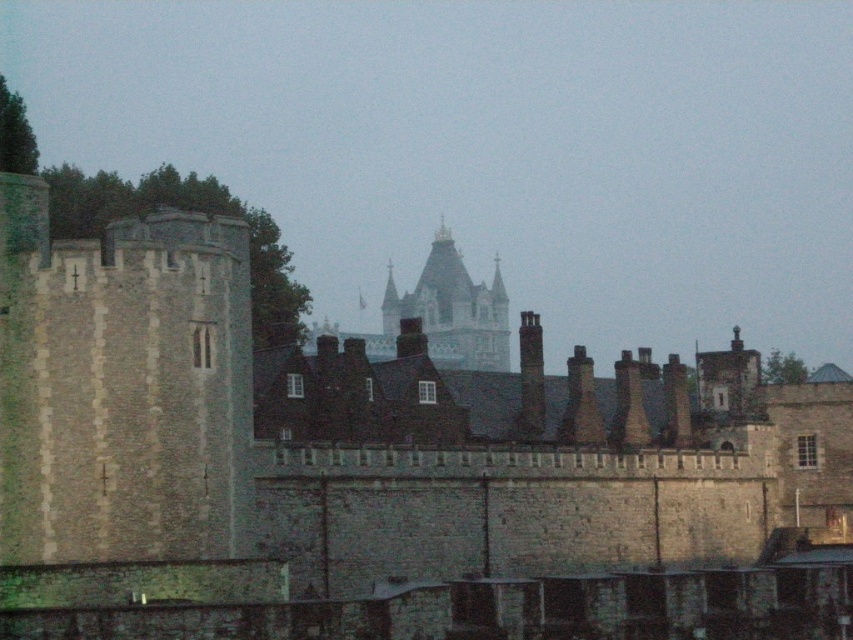
Based on the coordinates provided, where is the stone tower at left located in the image?

The stone tower at left is located at point (380,468) in the image.

You are standing in front of the historic castle wall and notice two points marked on the structure. The first point is at coordinates point (91, 586) and the second is at point (479, 305). Which of these two points is nearer to your current position?

Point (91, 586) is closer to the viewer than point (479, 305), so the first point is nearer to your current position.

You are an architect examining the castle ruins. You notice the stone tower at left and the stone spire at center. Which structure has a greater height?

The stone spire at center is taller than the stone tower at left.